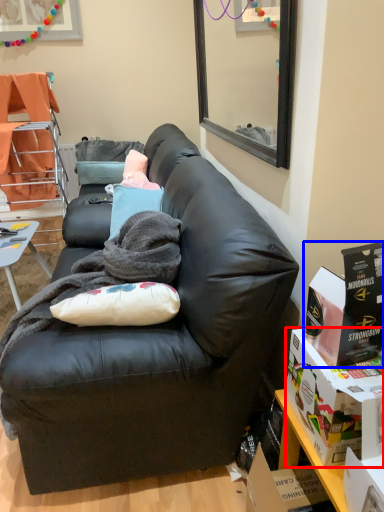
Question: Which of the following is the farthest to the observer, box (highlighted by a red box) or box (highlighted by a blue box)?

Choices:
 (A) box
 (B) box

Answer: (B)